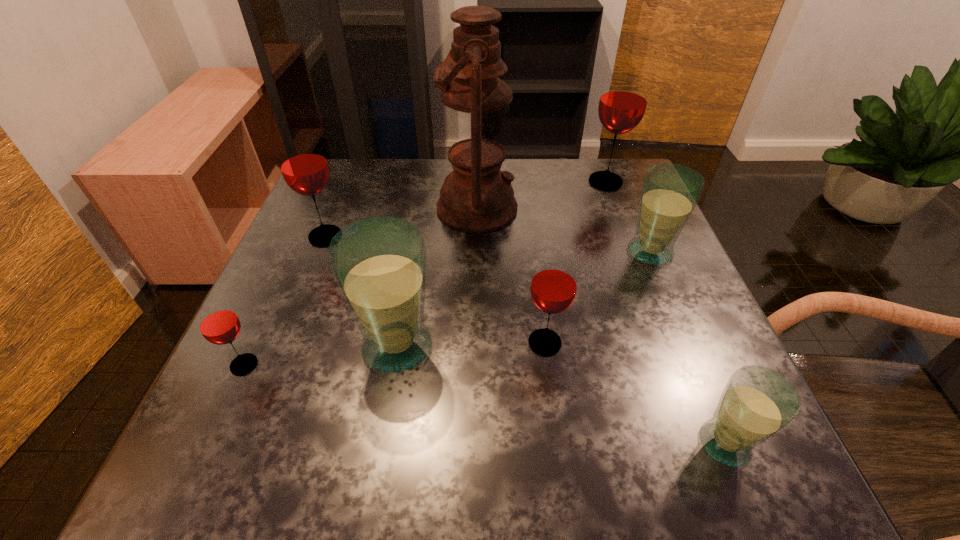
I want to click on the smallest blue glass, so click(x=757, y=403).

The height and width of the screenshot is (540, 960). What are the coordinates of `the nearest object` in the screenshot? It's located at pyautogui.click(x=757, y=403).

Locate an element on the screen. This screenshot has width=960, height=540. vacant region located on the front of the tallest object is located at coordinates (476, 278).

The image size is (960, 540). I want to click on vacant area located 0.060m on the left of the seventh shortest object, so click(561, 181).

Where is `vacant space located 0.130m on the back of the second farthest red glass`? vacant space located 0.130m on the back of the second farthest red glass is located at coordinates (343, 192).

In order to click on free space located 0.260m on the right of the leftmost blue glass in this screenshot , I will do pyautogui.click(x=589, y=346).

Identify the location of free space located 0.180m on the front of the third biggest red glass. pos(562,470).

I want to click on free region located on the back of the farthest blue glass, so click(x=615, y=170).

Image resolution: width=960 pixels, height=540 pixels. In order to click on blank space located 0.280m on the back of the smallest red glass in this screenshot , I will do `click(300, 244)`.

Locate an element on the screen. The height and width of the screenshot is (540, 960). vacant space located 0.270m on the left of the smallest blue glass is located at coordinates (506, 443).